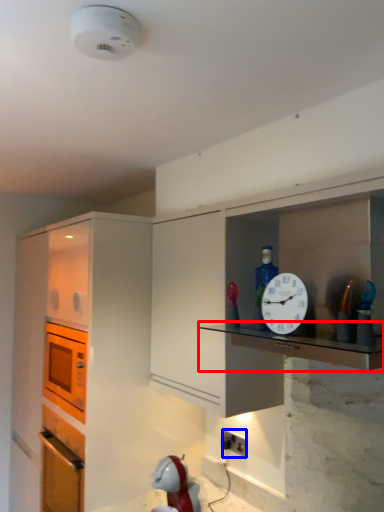
Question: Which object is further to the camera taking this photo, counter top (highlighted by a red box) or electric outlet (highlighted by a blue box)?

Choices:
 (A) counter top
 (B) electric outlet

Answer: (B)